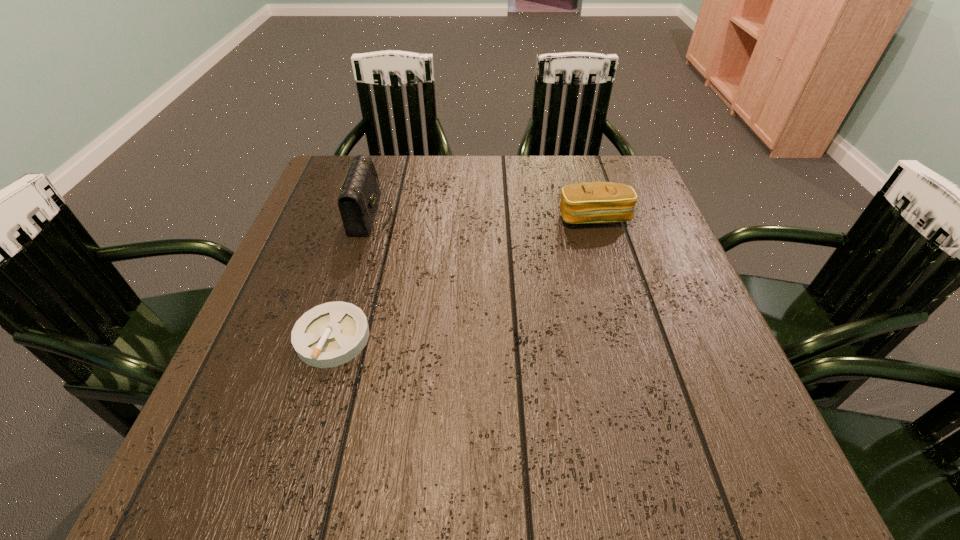
Find the location of `clutch bag that is at the left edge`. clutch bag that is at the left edge is located at coordinates (359, 196).

Find the location of a particular element. The height and width of the screenshot is (540, 960). ashtray that is positioned at the left edge is located at coordinates (331, 334).

Locate an element on the screen. This screenshot has height=540, width=960. object at the right edge is located at coordinates (591, 202).

Where is `object located at the far left corner`? The image size is (960, 540). object located at the far left corner is located at coordinates (359, 196).

Where is `free space at the far edge of the desktop`? The image size is (960, 540). free space at the far edge of the desktop is located at coordinates (506, 183).

You are a GUI agent. You are given a task and a screenshot of the screen. Output one action in this format:
    pyautogui.click(x=<x>, y=<y>)
    Task: Click on the vacant point at the near edge
    The width and height of the screenshot is (960, 540).
    Given the screenshot: What is the action you would take?
    pyautogui.click(x=336, y=458)

Locate an element on the screen. Image resolution: width=960 pixels, height=540 pixels. blank space at the left edge is located at coordinates (338, 278).

Identify the location of vacant region at the right edge of the desktop. (652, 300).

You are a GUI agent. You are given a task and a screenshot of the screen. Output one action in this format:
    pyautogui.click(x=<x>, y=<y>)
    Task: Click on the vacant space at the far left corner
    
    Given the screenshot: What is the action you would take?
    pyautogui.click(x=325, y=177)

The image size is (960, 540). In the image, there is a desktop. Identify the location of vacant space at the near left corner. (216, 441).